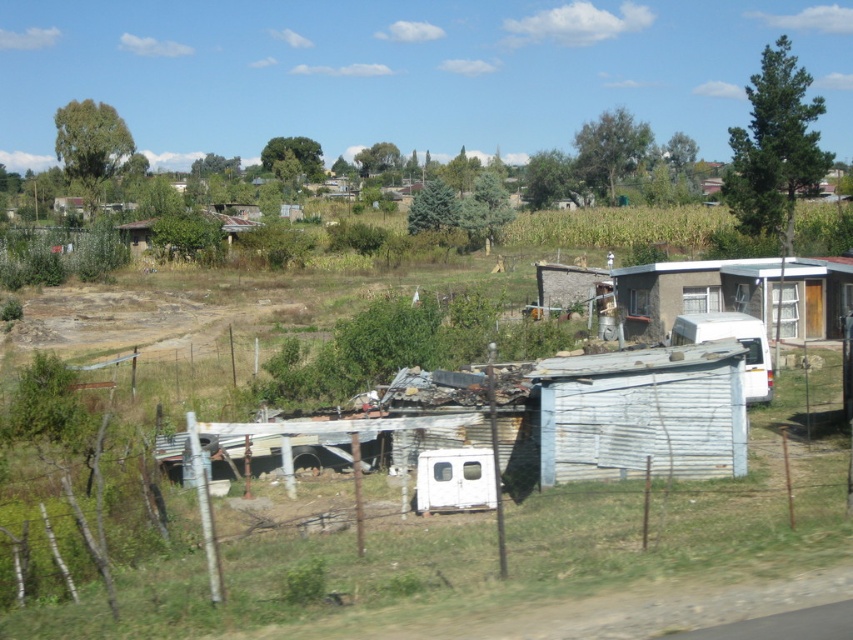
Is white corrugated metal hut at center-right thinner than rusty corrugated hut at center?

Yes.

Who is positioned more to the right, white corrugated metal hut at center-right or rusty corrugated hut at center?

white corrugated metal hut at center-right is more to the right.

Between point (688, 346) and point (206, 218), which one is positioned in front?

Point (688, 346) is in front.

You are a GUI agent. You are given a task and a screenshot of the screen. Output one action in this format:
    pyautogui.click(x=<x>, y=<y>)
    Task: Click on the white corrugated metal hut at center-right
    The image size is (853, 640).
    Given the screenshot: What is the action you would take?
    pyautogui.click(x=643, y=413)

Does white corrugated metal hut at center-right have a greater height compared to white corrugated metal hut at right?

No.

Is point (583, 449) positioned behind point (708, 284)?

No, (583, 449) is closer to viewer.

Identify the location of white corrugated metal hut at center-right. This screenshot has height=640, width=853. (643, 413).

Between white corrugated metal hut at right and rusty corrugated hut at center, which one appears on the left side from the viewer's perspective?

Positioned to the left is rusty corrugated hut at center.

Which is behind, point (773, 285) or point (137, 236)?

Positioned behind is point (137, 236).

Is point (776, 284) closer to camera compared to point (233, 221)?

Yes, point (776, 284) is closer to viewer.

You are a GUI agent. You are given a task and a screenshot of the screen. Output one action in this format:
    pyautogui.click(x=<x>, y=<y>)
    Task: Click on the white corrugated metal hut at right
    Image resolution: width=853 pixels, height=640 pixels.
    Given the screenshot: What is the action you would take?
    pyautogui.click(x=737, y=292)